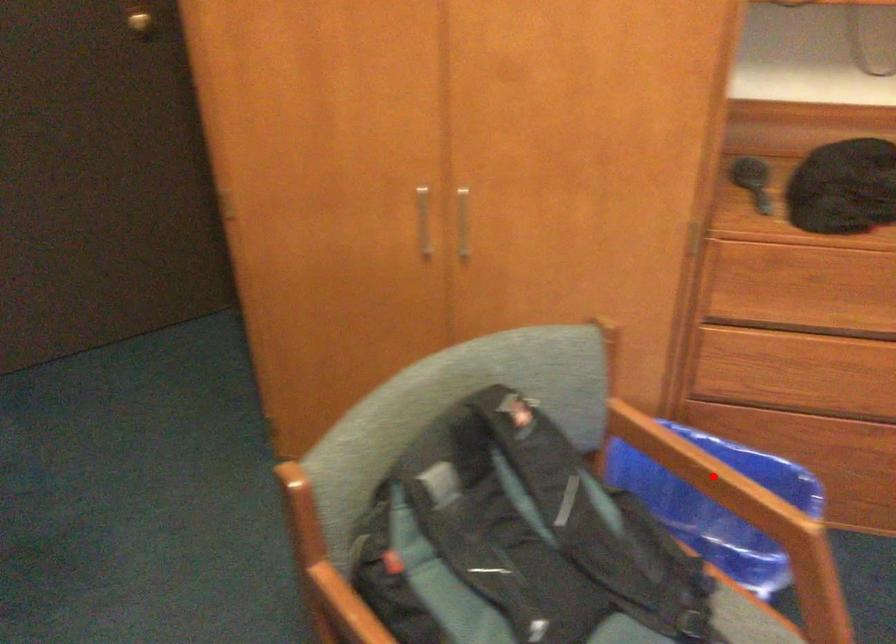
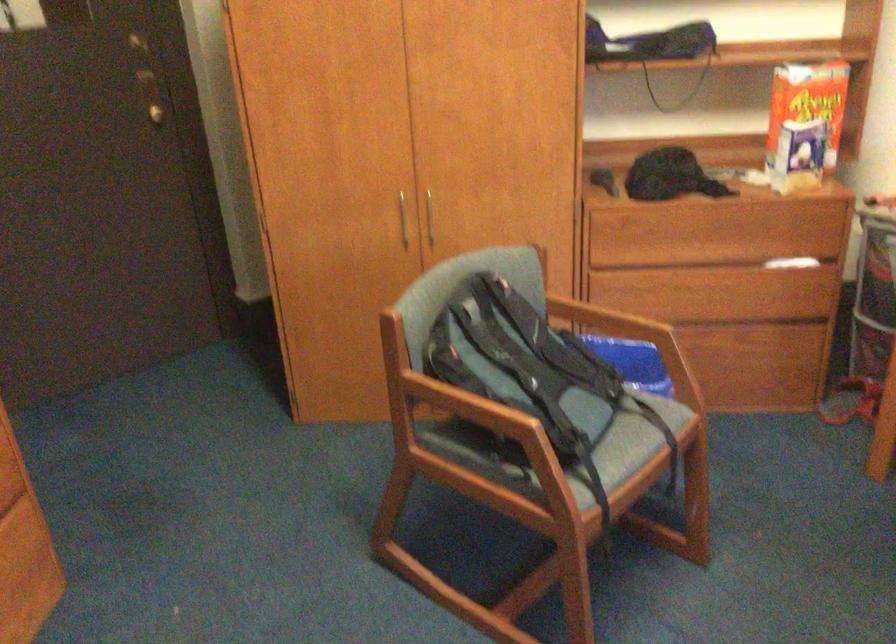
Question: I am providing you with two images of the same scene from different viewpoints. Given a red point in image1, look at the same physical point in image2. Is it:

Choices:
 (A) Closer to the viewpoint
 (B) Farther from the viewpoint

Answer: (B)